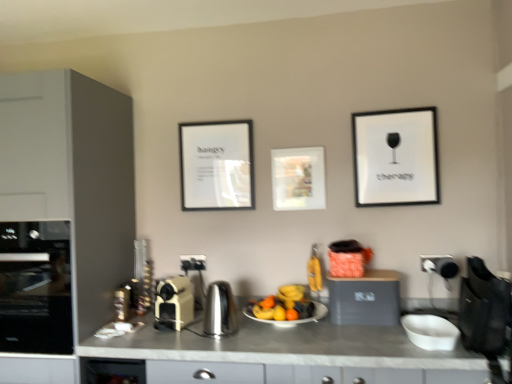
Question: Does white glossy plate at center come behind white matte bowl at lower right?

Choices:
 (A) no
 (B) yes

Answer: (B)

Question: From a real-world perspective, is white glossy plate at center under white matte bowl at lower right?

Choices:
 (A) no
 (B) yes

Answer: (A)

Question: From the image's perspective, is white glossy plate at center on white matte bowl at lower right?

Choices:
 (A) no
 (B) yes

Answer: (B)

Question: Does white glossy plate at center have a greater width compared to white matte bowl at lower right?

Choices:
 (A) no
 (B) yes

Answer: (B)

Question: Is white matte bowl at lower right at the back of white glossy plate at center?

Choices:
 (A) yes
 (B) no

Answer: (B)

Question: In terms of width, does matte black picture frame at center, marked as the third picture frame in a right-to-left arrangement, look wider or thinner when compared to matte gray toaster at center, placed as the first cabinetry when sorted from right to left?

Choices:
 (A) wide
 (B) thin

Answer: (B)

Question: Choose the correct answer: Is matte black picture frame at center, which is counted as the first picture frame, starting from the left, inside matte gray toaster at center, placed as the first cabinetry when sorted from right to left, or outside it?

Choices:
 (A) inside
 (B) outside

Answer: (B)

Question: In the image, is matte black picture frame at center, the 1th picture frame when ordered from back to front, positioned in front of or behind matte gray toaster at center, which is counted as the 1th cabinetry, starting from the bottom?

Choices:
 (A) front
 (B) behind

Answer: (B)

Question: Is matte black picture frame at center, marked as the third picture frame in a right-to-left arrangement, taller or shorter than matte gray toaster at center, placed as the 2th cabinetry when sorted from top to bottom?

Choices:
 (A) tall
 (B) short

Answer: (A)

Question: Is white matte bowl at lower right in front of or behind matte black toaster at center, the 2th electric outlet when ordered from right to left, in the image?

Choices:
 (A) front
 (B) behind

Answer: (A)

Question: Would you say white matte bowl at lower right is inside or outside matte black toaster at center, the 2th electric outlet when ordered from right to left?

Choices:
 (A) outside
 (B) inside

Answer: (A)

Question: From a real-world perspective, is white matte bowl at lower right positioned above or below matte black toaster at center, marked as the first electric outlet in a back-to-front arrangement?

Choices:
 (A) above
 (B) below

Answer: (B)

Question: Is point (422, 339) positioned closer to the camera than point (194, 264)?

Choices:
 (A) farther
 (B) closer

Answer: (B)

Question: Is matte glass picture frame at center, which ranks as the 2th picture frame in left-to-right order, wider or thinner than black glass oven at left?

Choices:
 (A) wide
 (B) thin

Answer: (B)

Question: From a real-world perspective, is matte glass picture frame at center, the second picture frame in the front-to-back sequence, positioned above or below black glass oven at left?

Choices:
 (A) above
 (B) below

Answer: (A)